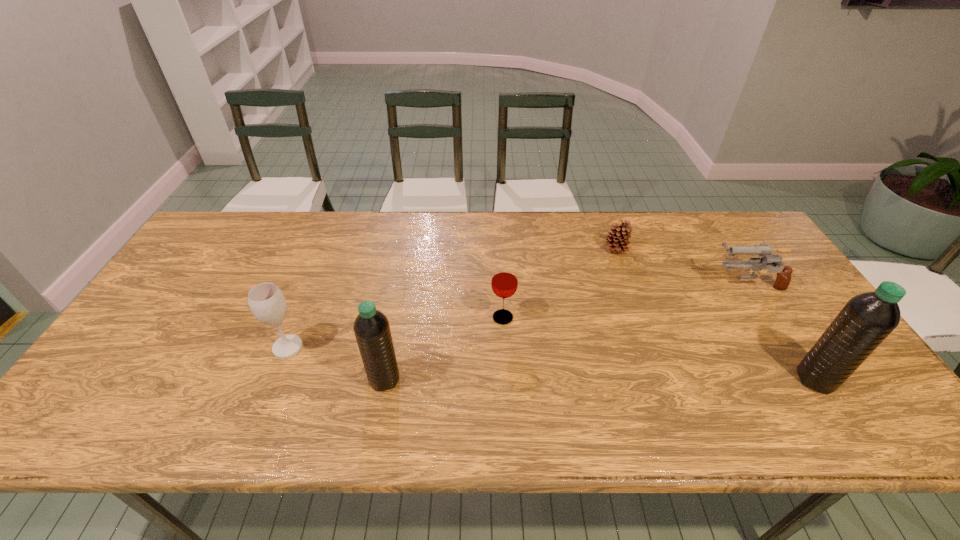
Where is `the shorter water bottle`? the shorter water bottle is located at coordinates (371, 327).

Where is `the fifth object from right to left`? Image resolution: width=960 pixels, height=540 pixels. the fifth object from right to left is located at coordinates (371, 327).

Identify the location of the taller water bottle. (867, 319).

Identify the location of the tallest object. The image size is (960, 540). tap(867, 319).

Find the location of a particular element. the fourth object from left to right is located at coordinates (617, 240).

You are a GUI agent. You are given a task and a screenshot of the screen. Output one action in this format:
    pyautogui.click(x=<x>, y=<y>)
    Task: Click on the shortest object
    The height and width of the screenshot is (540, 960).
    Given the screenshot: What is the action you would take?
    pyautogui.click(x=617, y=240)

Locate an element on the screen. the third farthest object is located at coordinates (504, 282).

The width and height of the screenshot is (960, 540). Identify the location of glass. (504, 282).

Where is `the leftmost object`? the leftmost object is located at coordinates (267, 303).

What are the coordinates of `the fourth farthest object` in the screenshot? It's located at (267, 303).